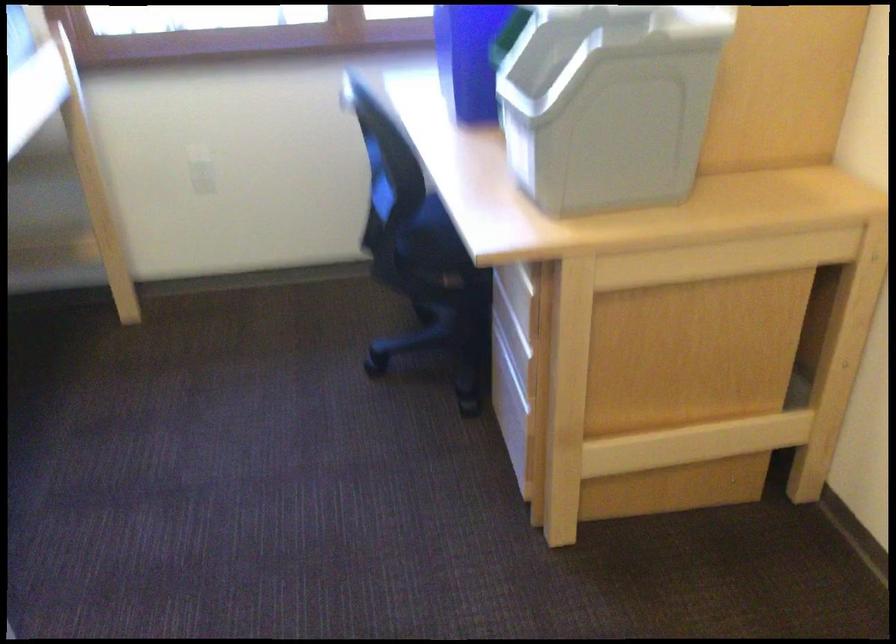
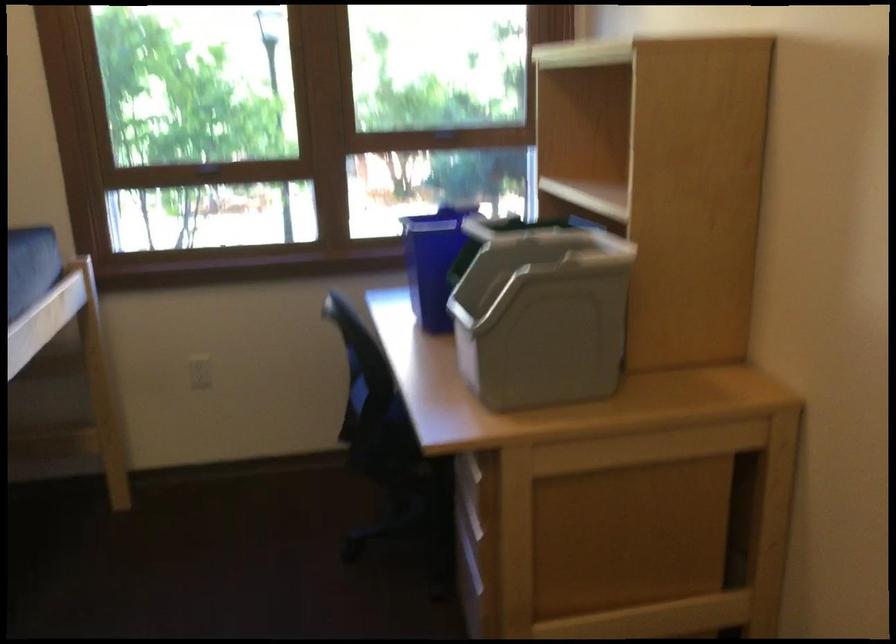
Question: How did the camera likely rotate?

Choices:
 (A) Left
 (B) Right
 (C) Up
 (D) Down

Answer: (C)